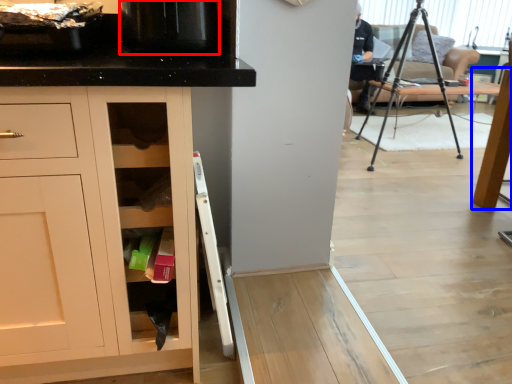
Question: Which object appears farthest to the camera in this image, appliance (highlighted by a red box) or table (highlighted by a blue box)?

Choices:
 (A) appliance
 (B) table

Answer: (B)